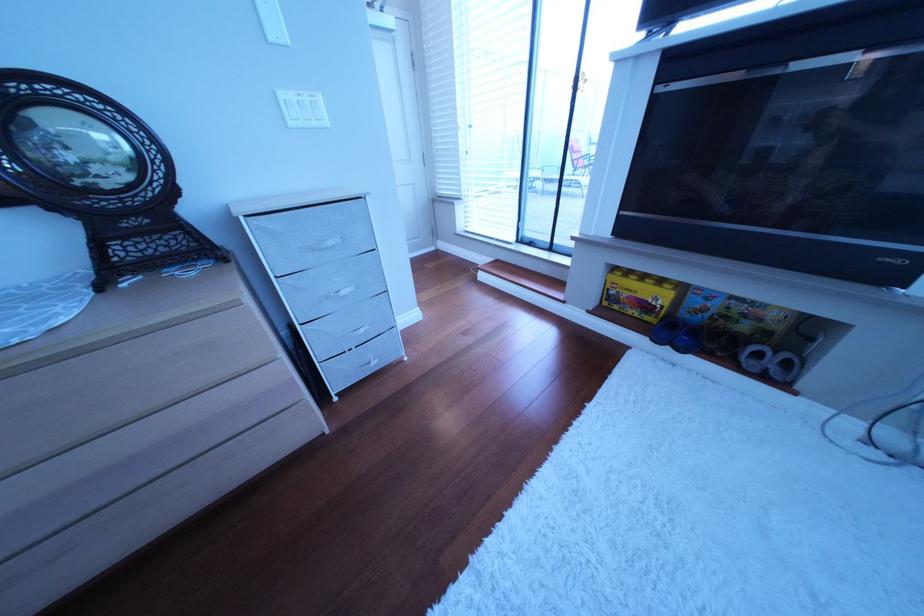
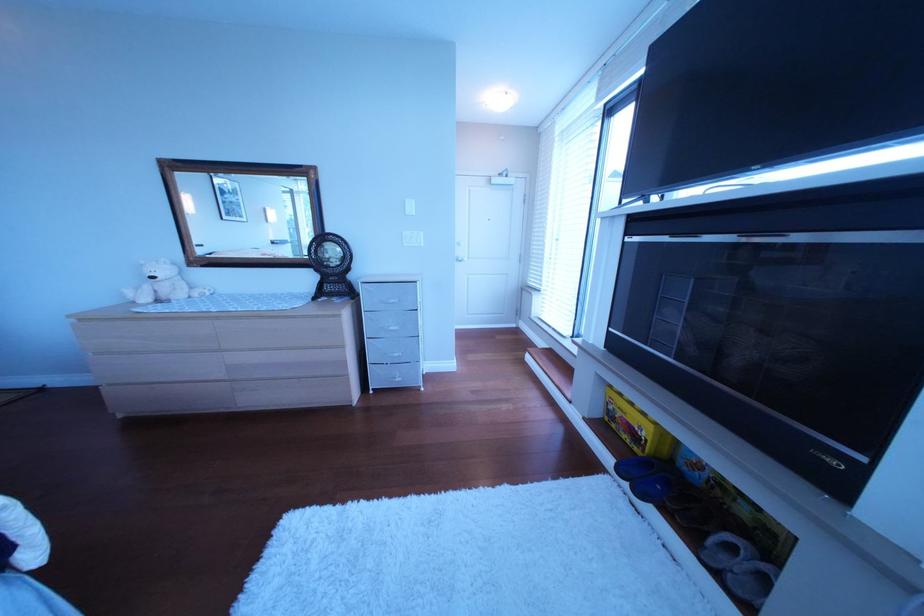
Question: The images are taken continuously from a first-person perspective. In which direction is your viewpoint rotating?

Choices:
 (A) Left
 (B) Right
 (C) Up
 (D) Down

Answer: (A)